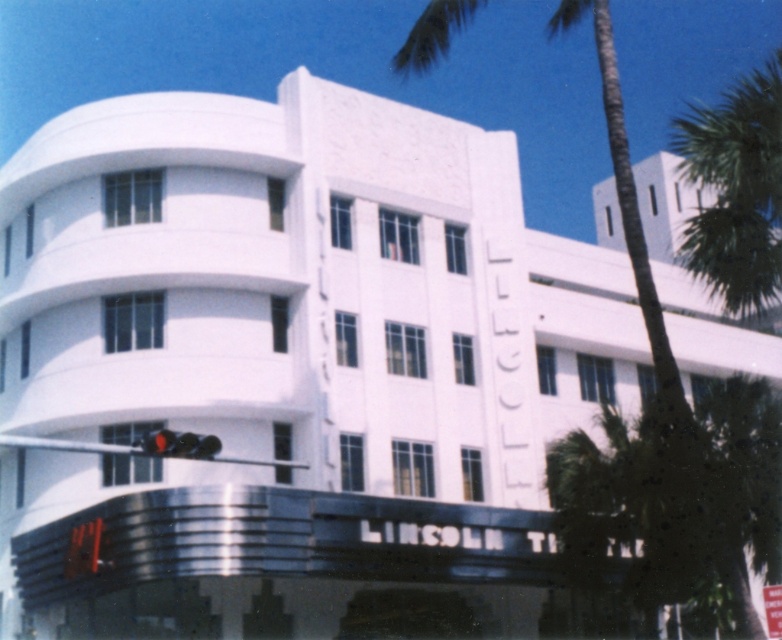
You are standing in front of the LINCOLN THEATRE and want to take a photo that includes both the theater name and the green leafy palm tree at center. Based on their positions, where should you position the palm tree in your photo?

The green leafy palm tree at center is located at point (626, 198), so to include both the theater name and the palm tree in your photo, position the palm tree near the lower central part of the frame.

You are a pedestrian standing on the sidewalk in front of the LINCOLN THEATRE. You see the matte black traffic light at lower center and the white plastic street sign at center. Which object is closer to the left side of your view?

The matte black traffic light at lower center is to the left of the white plastic street sign at center, so it is closer to the left side of your view.

You are a city planner designing a new pedestrian path. The path must pass between the matte black traffic light at lower center and the white plastic street sign at center. What is the minimum width required for the path to ensure pedestrians can comfortably walk between them?

The minimum width required for the path should be at least 62.04 feet to accommodate the distance between the matte black traffic light at lower center and the white plastic street sign at center.